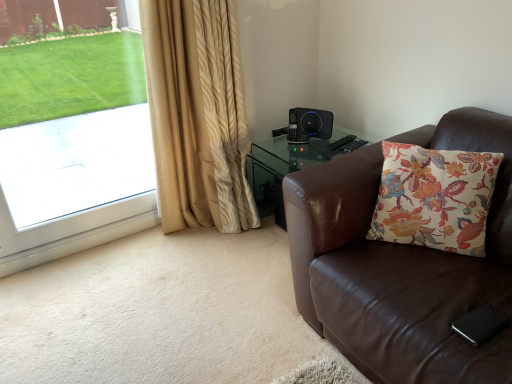
Question: From a real-world perspective, relative to white glass window at left, is floral fabric cushion at right vertically above or below?

Choices:
 (A) below
 (B) above

Answer: (A)

Question: Is floral fabric cushion at right inside or outside of white glass window at left?

Choices:
 (A) inside
 (B) outside

Answer: (B)

Question: Which object is the farthest from the white glass window at left?

Choices:
 (A) brown leather chair at right
 (B) floral fabric cushion at right
 (C) beige textured curtain at left
 (D) black plastic speaker at upper right

Answer: (B)

Question: Which object is the closest to the black plastic speaker at upper right?

Choices:
 (A) beige textured curtain at left
 (B) brown leather chair at right
 (C) floral fabric cushion at right
 (D) white glass window at left

Answer: (A)